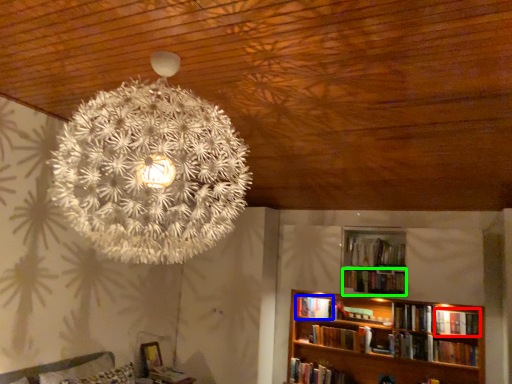
Question: Estimate the real-world distances between objects in this image. Which object is closer to book (highlighted by a red box), book (highlighted by a blue box) or book (highlighted by a green box)?

Choices:
 (A) book
 (B) book

Answer: (B)